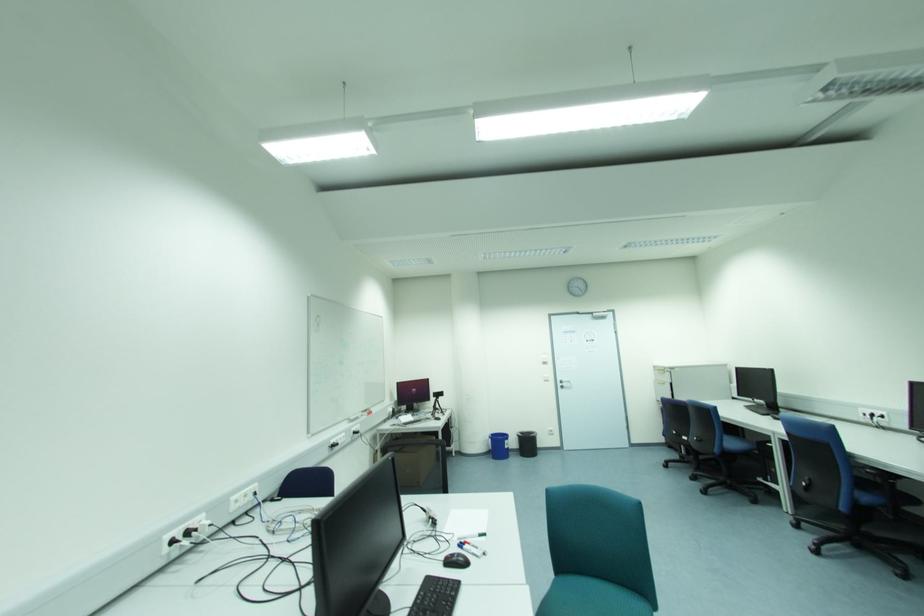
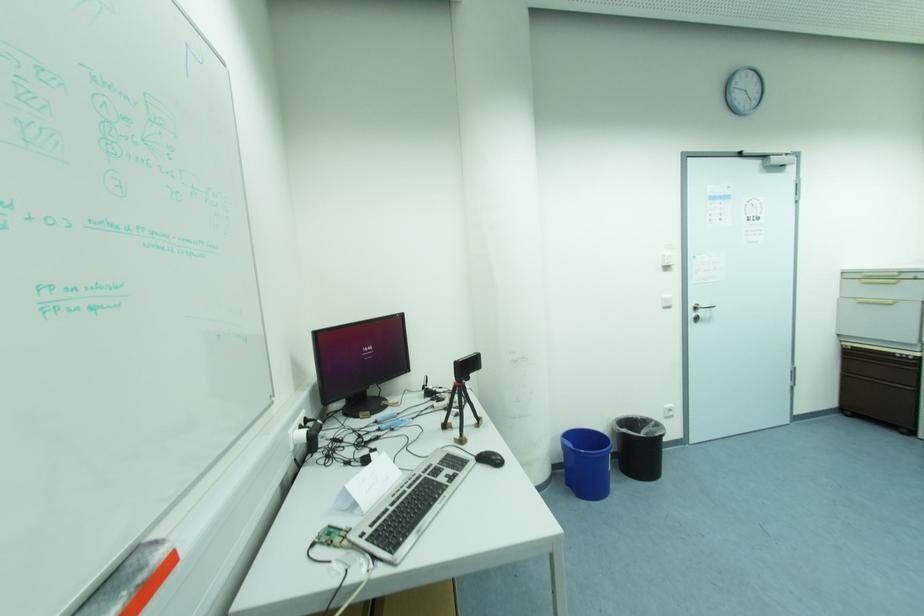
In the second image, find the point that corresponds to point 429,379 in the first image.

(402, 317)